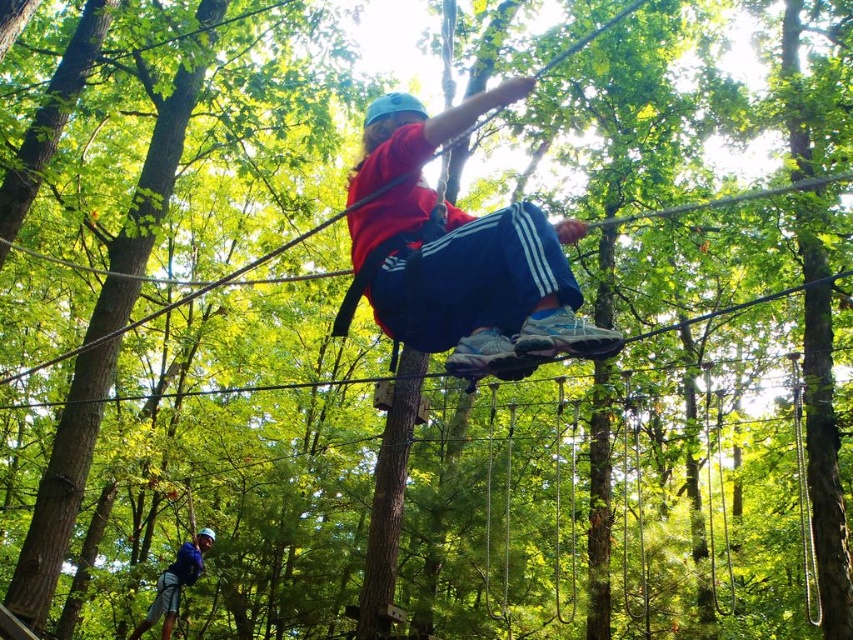
Question: Is matte red shirt at center smaller than blue fabric helmet at lower left?

Choices:
 (A) no
 (B) yes

Answer: (A)

Question: Which object is farther from the camera taking this photo?

Choices:
 (A) matte red shirt at center
 (B) blue fabric helmet at lower left

Answer: (B)

Question: Is matte red shirt at center below blue fabric helmet at lower left?

Choices:
 (A) no
 (B) yes

Answer: (A)

Question: Is matte red shirt at center bigger than blue fabric helmet at lower left?

Choices:
 (A) yes
 (B) no

Answer: (A)

Question: Which of the following is the closest to the observer?

Choices:
 (A) matte red shirt at center
 (B) blue fabric helmet at lower left

Answer: (A)

Question: Which object appears farthest from the camera in this image?

Choices:
 (A) matte red shirt at center
 (B) blue fabric helmet at lower left

Answer: (B)